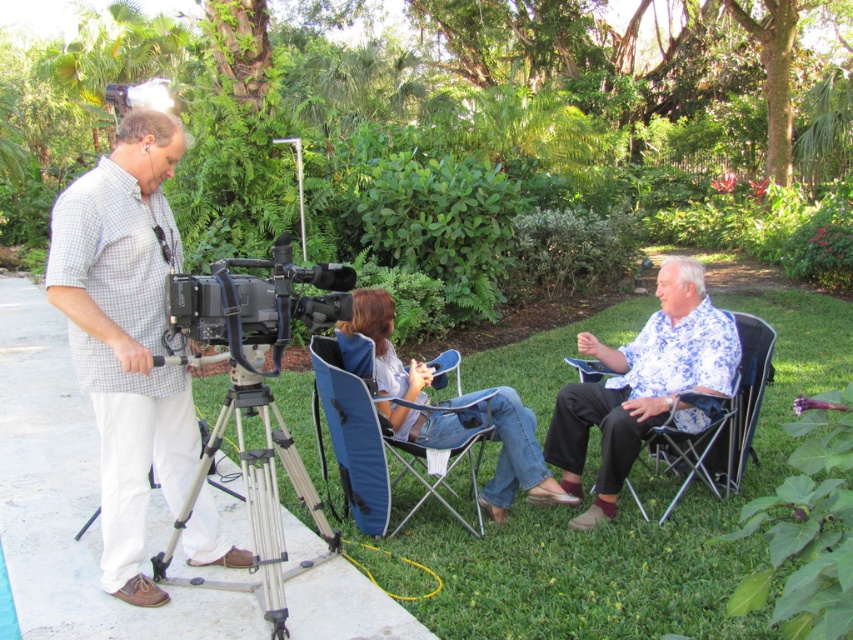
You are a photographer trying to set up a tripod in the garden. You have the blue floral shirt at center and the black plastic camera at center in your view. Which object should you avoid placing the tripod under to ensure it doesn not block the camera lens?

The blue floral shirt at center is much taller than the black plastic camera at center, so you should avoid placing the tripod under the blue floral shirt at center to prevent it from blocking the camera lens.

You are standing at the center of the garden and want to locate the checkered fabric shirt at left. In which direction should you look to find it?

The checkered fabric shirt at left is located at point (x=126, y=336), so you should look to the left side of the scene to find it.

You are a camera operator standing at the edge of the garden. You need to position your camera so that it faces the blue fabric chair at center. Which direction should you move your camera to align it properly?

The blue fabric chair at center is located at point 0.686 on the x axis and 0.437 on the y axis. To align the camera facing the chair, you should position the camera so that it is pointing towards these coordinates.